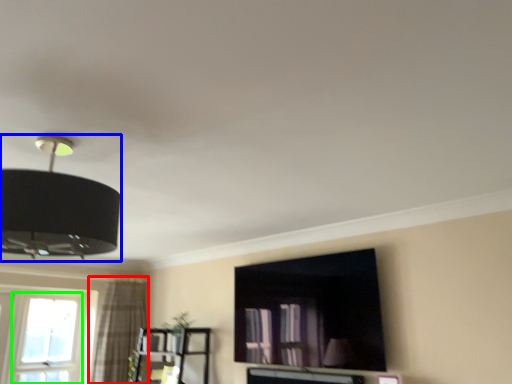
Question: Which object is the closest to the curtain (highlighted by a red box)? Choose among these: lamp (highlighted by a blue box) or window (highlighted by a green box).

Choices:
 (A) lamp
 (B) window

Answer: (B)